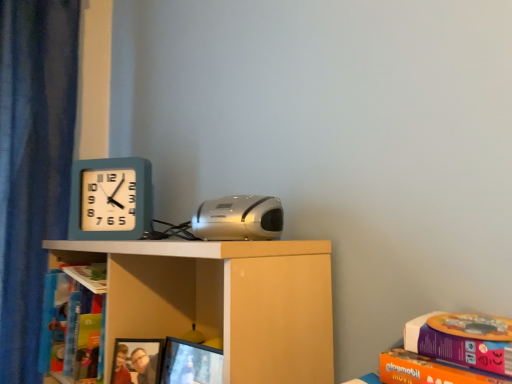
Question: Considering the positions of point (129, 357) and point (59, 266), is point (129, 357) closer or farther from the camera than point (59, 266)?

Choices:
 (A) farther
 (B) closer

Answer: (B)

Question: From the image's perspective, is matte plastic picture frame at lower center located above or below hardcover book at left, which ranks as the second book in back-to-front order?

Choices:
 (A) below
 (B) above

Answer: (A)

Question: Which of these objects is positioned farthest from the hardcover book at left, which ranks as the 1th book in top-to-bottom order?

Choices:
 (A) teal plastic wall clock at upper left
 (B) blue cardboard book at left, acting as the 1th book starting from the bottom
 (C) matte black monitor at lower center
 (D) white matte shelf at center
 (E) silver metallic stereo at center

Answer: (E)

Question: Considering the real-world distances, which object is farthest from the matte black monitor at lower center?

Choices:
 (A) teal plastic wall clock at upper left
 (B) hardcover book at left, the first book from the front
 (C) silver metallic stereo at center
 (D) matte plastic picture frame at lower center
 (E) blue cardboard book at left, acting as the 2th book starting from the front

Answer: (A)